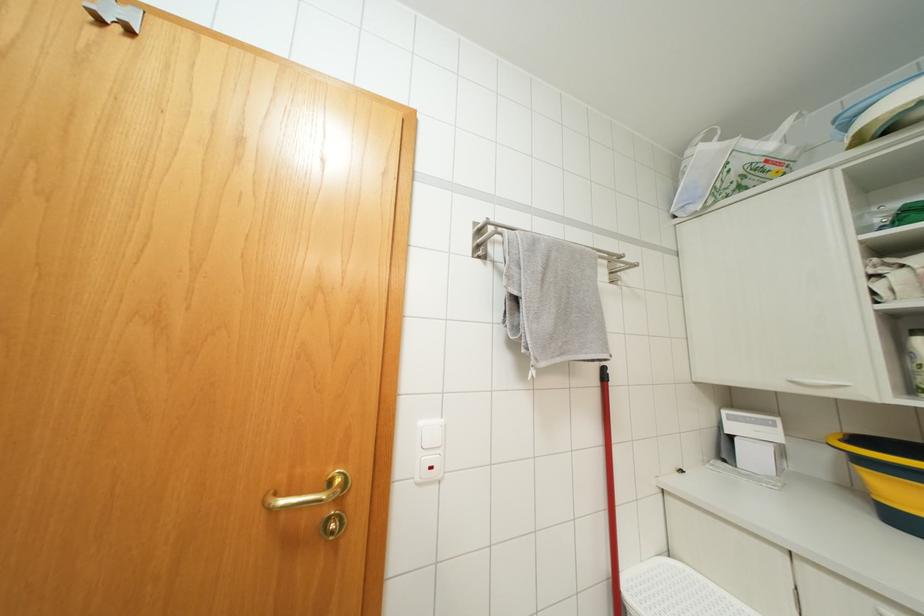
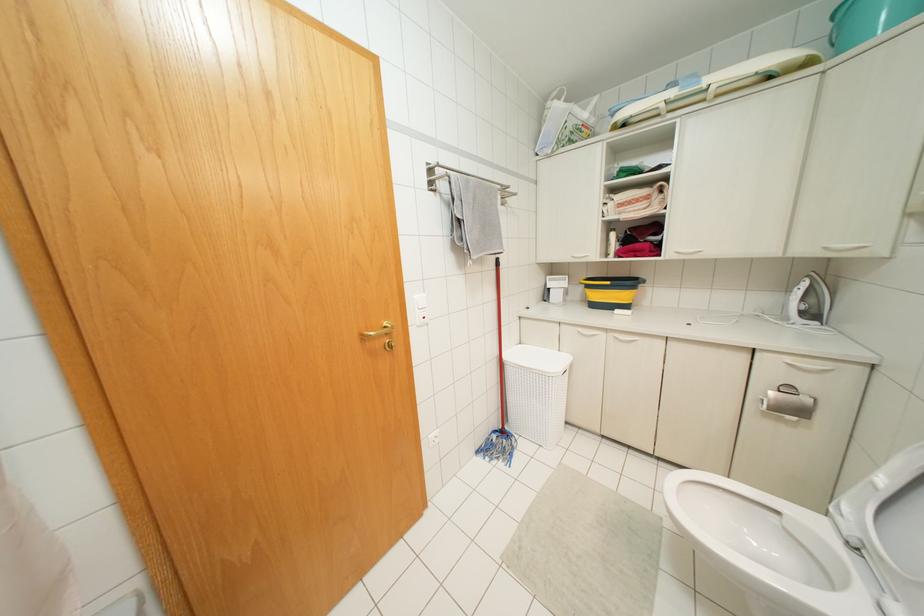
Based on the continuous images, in which direction is the camera rotating?

The camera's rotation is toward right-down.